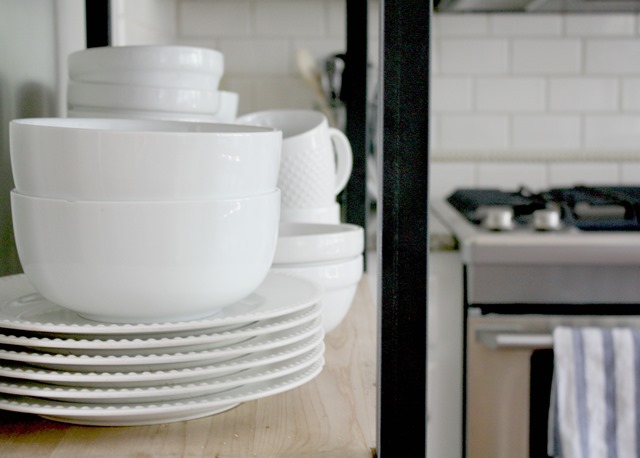
The height and width of the screenshot is (458, 640). I want to click on white plates, so click(262, 387), click(260, 371), click(262, 359), click(264, 339), click(268, 319).